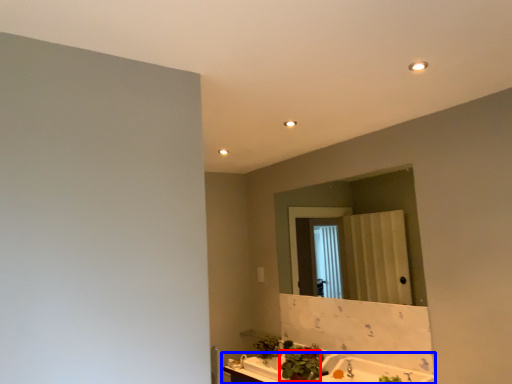
Question: Which point is further to the camera, plant (highlighted by a red box) or counter top (highlighted by a blue box)?

Choices:
 (A) plant
 (B) counter top

Answer: (A)